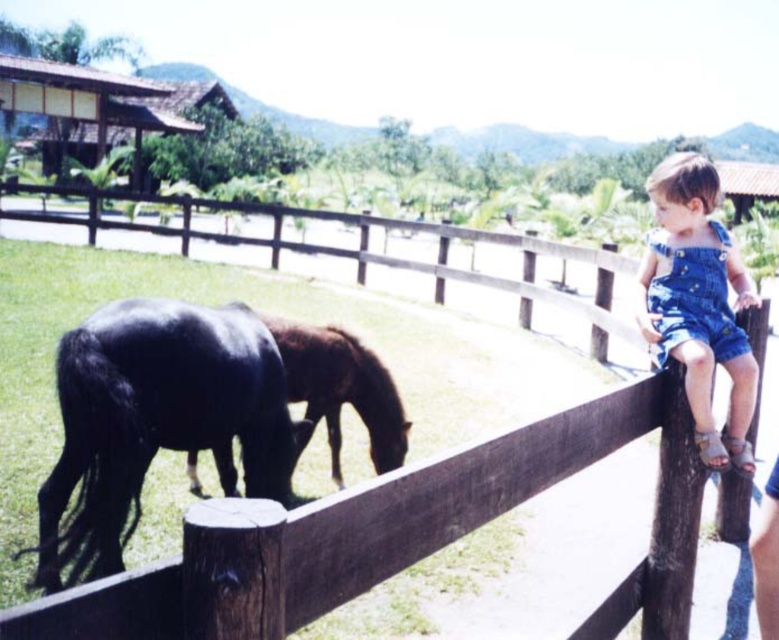
You are a photographer trying to capture a photo of both the shiny black horse at lower left and the shiny brown horse at center. Since you want both horses to be in the same frame, which horse should you position your camera closer to in order to include both?

You should position your camera closer to the shiny black horse at lower left because it is on the left side of the shiny brown horse at center, allowing both to be captured in the frame when centered appropriately.

You are a farmer checking the layout of your paddock. You have a new fence post that needs to be placed between the shiny black horse at lower left and the shiny brown horse at center. Based on their current positions, where should you place the fence post to ensure it is between them?

The shiny black horse at lower left is positioned under the shiny brown horse at center, so placing the fence post directly below the shiny brown horse at center would position it between the two horses.